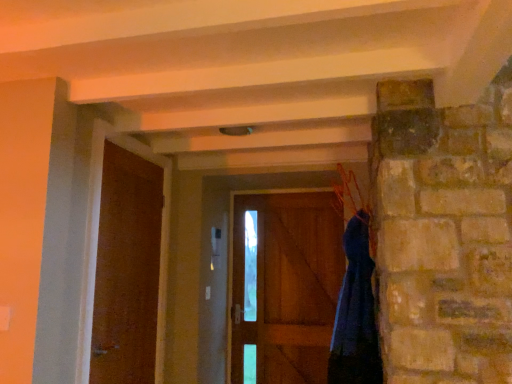
Question: From the image's perspective, is brown wooden door at center, arranged as the second door when viewed from the left, beneath wooden door at left, which is the second door in back-to-front order?

Choices:
 (A) no
 (B) yes

Answer: (B)

Question: Is brown wooden door at center, which is the first door from back to front, outside wooden door at left, which is counted as the first door, starting from the left?

Choices:
 (A) no
 (B) yes

Answer: (B)

Question: Is brown wooden door at center, which is the first door from back to front, positioned with its back to wooden door at left, which is the second door in back-to-front order?

Choices:
 (A) no
 (B) yes

Answer: (A)

Question: From a real-world perspective, is brown wooden door at center, placed as the 2th door when sorted from front to back, over wooden door at left, marked as the 1th door in a front-to-back arrangement?

Choices:
 (A) no
 (B) yes

Answer: (A)

Question: Is brown wooden door at center, positioned as the first door in right-to-left order, behind wooden door at left, marked as the 1th door in a front-to-back arrangement?

Choices:
 (A) no
 (B) yes

Answer: (B)

Question: Considering the relative positions of brown wooden door at center, placed as the 2th door when sorted from front to back, and wooden door at left, which is counted as the first door, starting from the left, in the image provided, is brown wooden door at center, placed as the 2th door when sorted from front to back, to the right of wooden door at left, which is counted as the first door, starting from the left, from the viewer's perspective?

Choices:
 (A) yes
 (B) no

Answer: (A)

Question: Is brown wooden door at center, arranged as the second door when viewed from the left, facing away from blue fabric hanger at upper right?

Choices:
 (A) yes
 (B) no

Answer: (B)

Question: Is the position of brown wooden door at center, positioned as the first door in right-to-left order, more distant than that of blue fabric hanger at upper right?

Choices:
 (A) yes
 (B) no

Answer: (A)

Question: Does brown wooden door at center, positioned as the first door in right-to-left order, turn towards blue fabric hanger at upper right?

Choices:
 (A) no
 (B) yes

Answer: (B)

Question: Is brown wooden door at center, which is the first door from back to front, wider than blue fabric hanger at upper right?

Choices:
 (A) yes
 (B) no

Answer: (B)

Question: Considering the relative sizes of brown wooden door at center, which is the first door from back to front, and blue fabric hanger at upper right in the image provided, is brown wooden door at center, which is the first door from back to front, shorter than blue fabric hanger at upper right?

Choices:
 (A) yes
 (B) no

Answer: (B)

Question: Is brown wooden door at center, positioned as the first door in right-to-left order, thinner than blue fabric hanger at upper right?

Choices:
 (A) yes
 (B) no

Answer: (A)

Question: Is blue fabric hanger at upper right positioned far away from brown wooden door at center, positioned as the first door in right-to-left order?

Choices:
 (A) yes
 (B) no

Answer: (B)